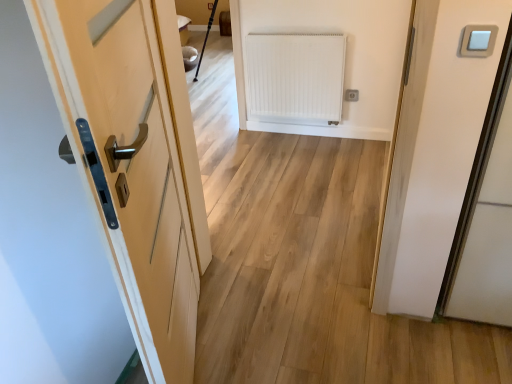
Question: From a real-world perspective, is white matte radiator at center positioned over white plastic light switch at upper right based on gravity?

Choices:
 (A) yes
 (B) no

Answer: (B)

Question: Is white matte radiator at center facing away from white plastic light switch at upper right?

Choices:
 (A) yes
 (B) no

Answer: (B)

Question: Is white matte radiator at center taller than white plastic light switch at upper right?

Choices:
 (A) yes
 (B) no

Answer: (A)

Question: From the image's perspective, would you say white matte radiator at center is positioned over white plastic light switch at upper right?

Choices:
 (A) yes
 (B) no

Answer: (A)

Question: Considering the relative sizes of white matte radiator at center and white plastic light switch at upper right in the image provided, is white matte radiator at center smaller than white plastic light switch at upper right?

Choices:
 (A) yes
 (B) no

Answer: (B)

Question: From the image's perspective, relative to matte wood door at left, is white plastic electric outlet at upper right above or below?

Choices:
 (A) above
 (B) below

Answer: (A)

Question: Considering the positions of point (357, 91) and point (151, 160), is point (357, 91) closer or farther from the camera than point (151, 160)?

Choices:
 (A) farther
 (B) closer

Answer: (A)

Question: Is white plastic electric outlet at upper right taller or shorter than matte wood door at left?

Choices:
 (A) tall
 (B) short

Answer: (B)

Question: Based on their positions, is white plastic electric outlet at upper right located to the left or right of matte wood door at left?

Choices:
 (A) left
 (B) right

Answer: (B)

Question: Is white matte radiator at center inside or outside of matte wood door at left?

Choices:
 (A) inside
 (B) outside

Answer: (B)

Question: Looking at their shapes, would you say white matte radiator at center is wider or thinner than matte wood door at left?

Choices:
 (A) thin
 (B) wide

Answer: (A)

Question: Would you say white matte radiator at center is to the left or to the right of matte wood door at left in the picture?

Choices:
 (A) right
 (B) left

Answer: (A)

Question: Considering the positions of white matte radiator at center and matte wood door at left in the image, is white matte radiator at center taller or shorter than matte wood door at left?

Choices:
 (A) tall
 (B) short

Answer: (B)

Question: Does point (477, 36) appear closer or farther from the camera than point (349, 89)?

Choices:
 (A) closer
 (B) farther

Answer: (A)

Question: Is white plastic light switch at upper right bigger or smaller than white plastic electric outlet at upper right?

Choices:
 (A) big
 (B) small

Answer: (B)